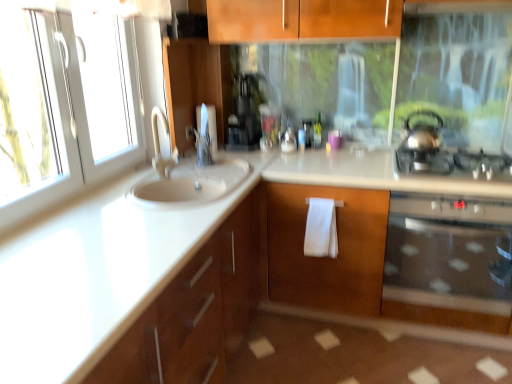
Question: Is stainless steel oven at right bigger or smaller than white glossy sink at left?

Choices:
 (A) small
 (B) big

Answer: (A)

Question: In the image, is stainless steel oven at right positioned in front of or behind white glossy sink at left?

Choices:
 (A) front
 (B) behind

Answer: (B)

Question: Which object is positioned farthest from the satin silver gas stove at right?

Choices:
 (A) white glossy toilet paper at upper center
 (B) white cotton bath towel at center
 (C) stainless steel oven at right
 (D) white glossy sink at left
 (E) shiny metallic kettle at right

Answer: (A)

Question: Considering the real-world distances, which object is closest to the white glossy sink at left?

Choices:
 (A) satin silver gas stove at right
 (B) shiny metallic kettle at right
 (C) white glossy toilet paper at upper center
 (D) stainless steel oven at right
 (E) white cotton bath towel at center

Answer: (D)